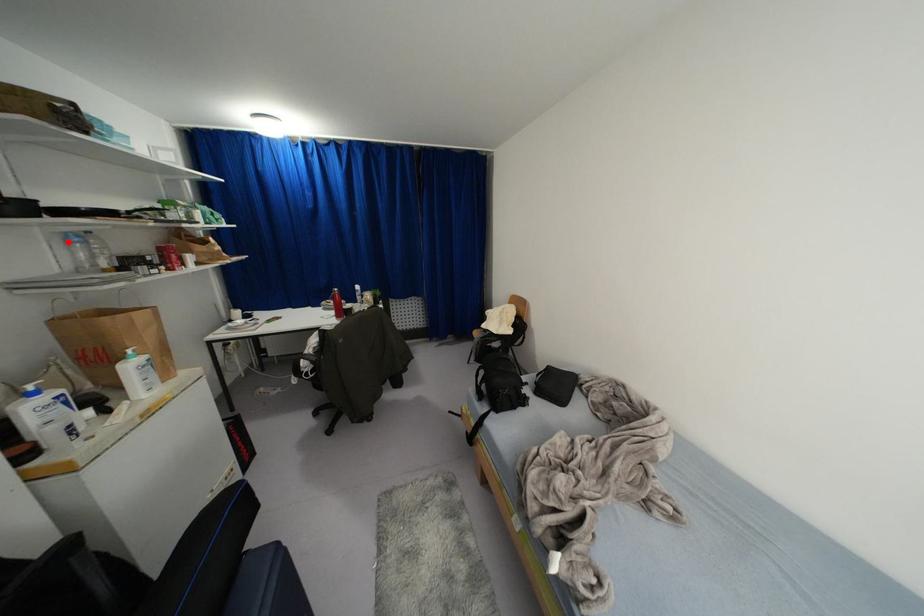
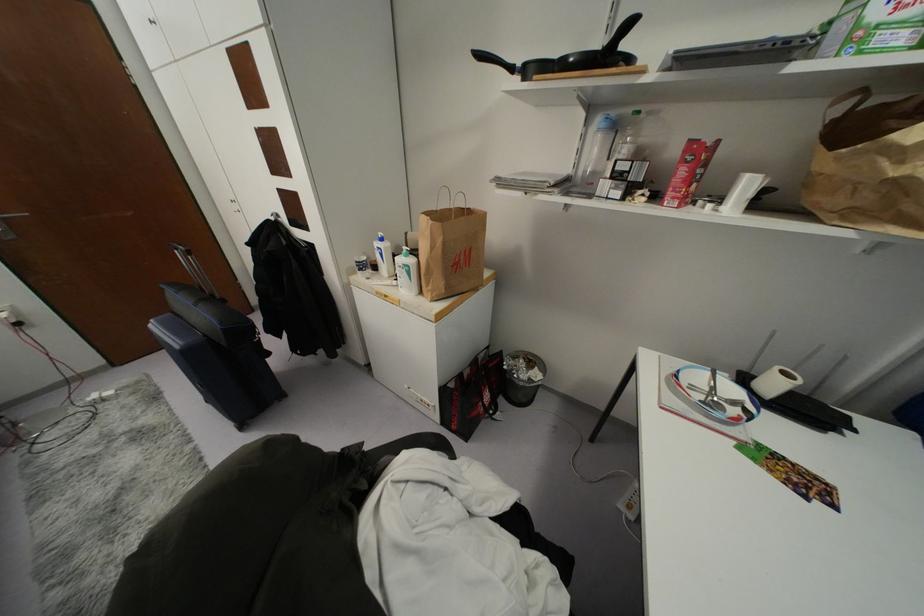
Question: I am providing you with two images of the same scene from different viewpoints. Image1 has a red point marked. In image2, the corresponding 3D location appears at what relative position? Reply with the corresponding letter.

Choices:
 (A) Closer
 (B) Farther

Answer: (A)